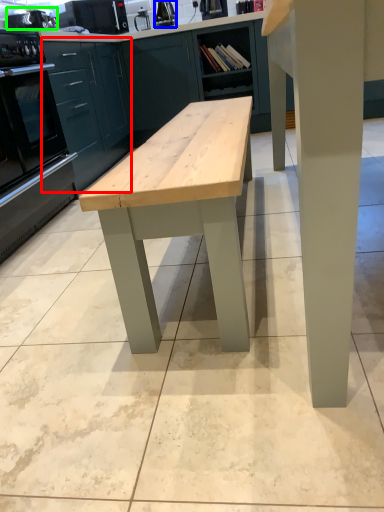
Question: Estimate the real-world distances between objects in this image. Which object is closer to cabinetry (highlighted by a red box), appliance (highlighted by a blue box) or appliance (highlighted by a green box)?

Choices:
 (A) appliance
 (B) appliance

Answer: (B)